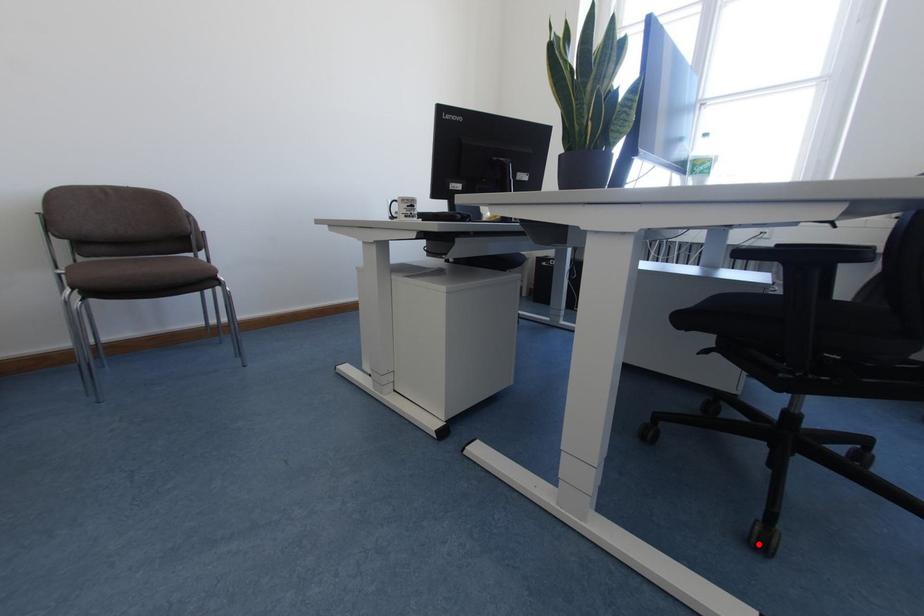
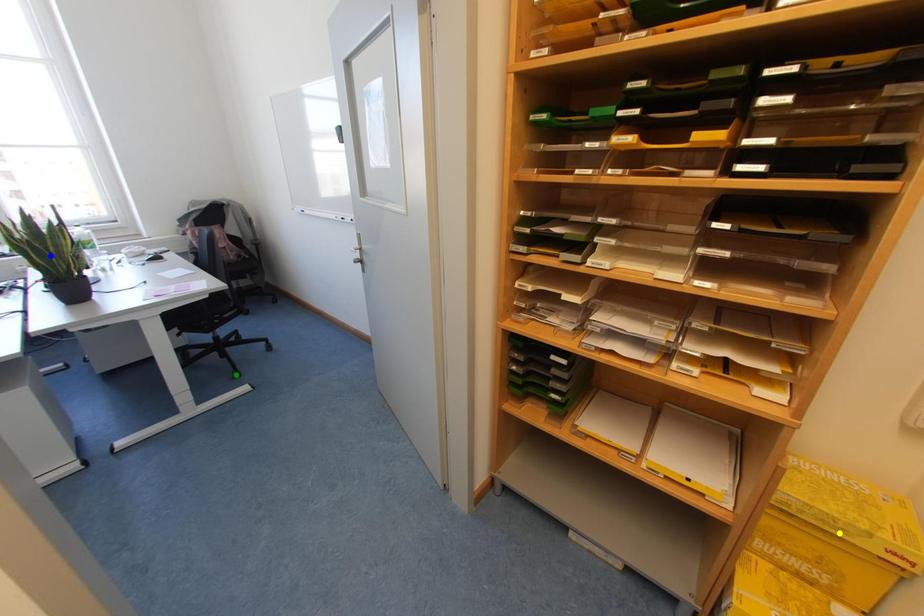
Question: I am providing you with two images of the same scene from different viewpoints. A red point is marked on the first image. You are given multiple points on the second image. Which spot in image 2 lines up with the point in image 1?

Choices:
 (A) yellow point
 (B) green point
 (C) blue point

Answer: (B)